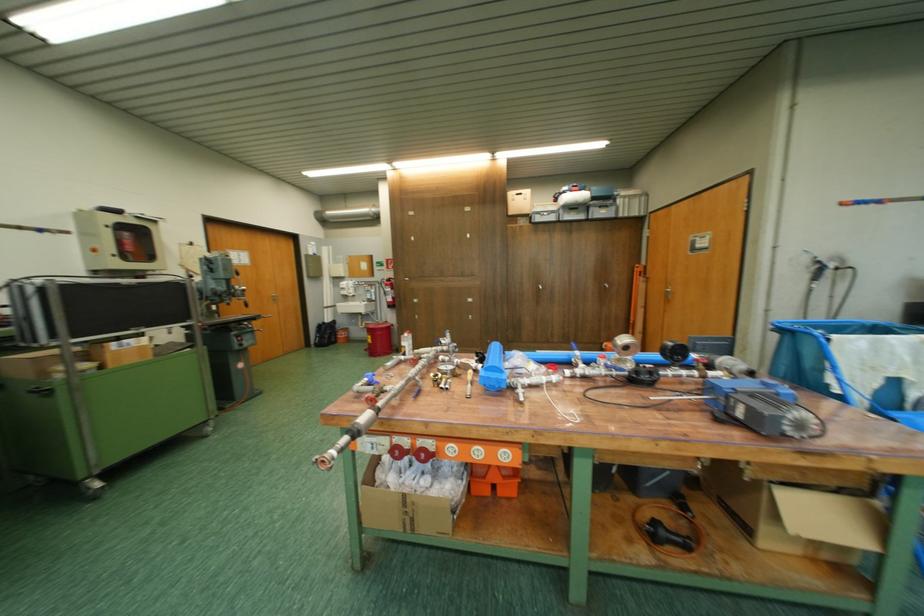
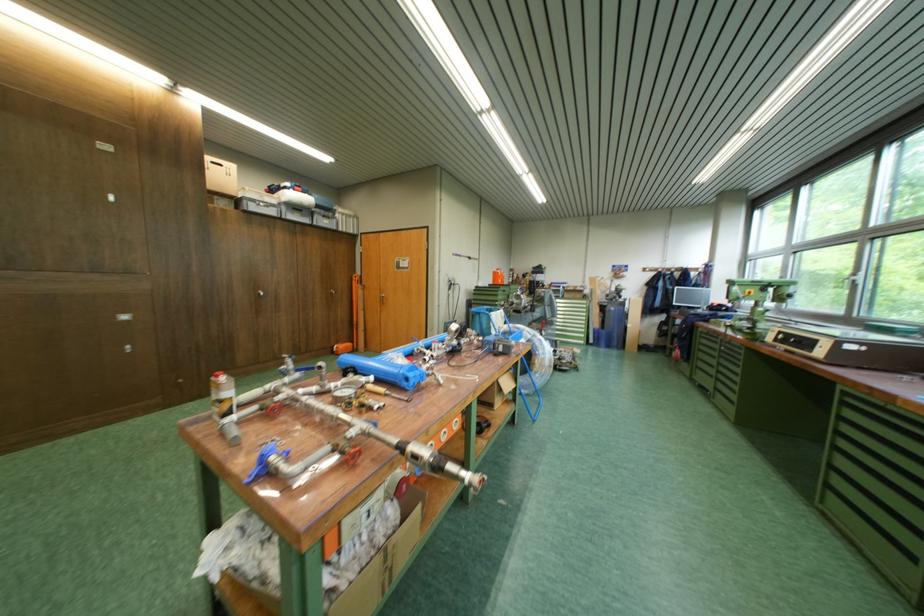
Question: Based on the continuous images, in which direction is the camera rotating? Reply with the corresponding letter.

Choices:
 (A) Left
 (B) Right
 (C) Up
 (D) Down

Answer: (B)